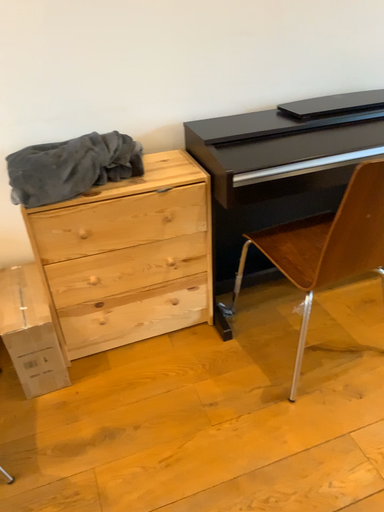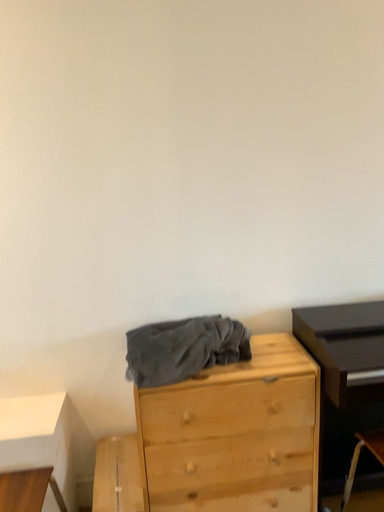
Question: Which way did the camera rotate in the video?

Choices:
 (A) rotated left
 (B) rotated right

Answer: (A)